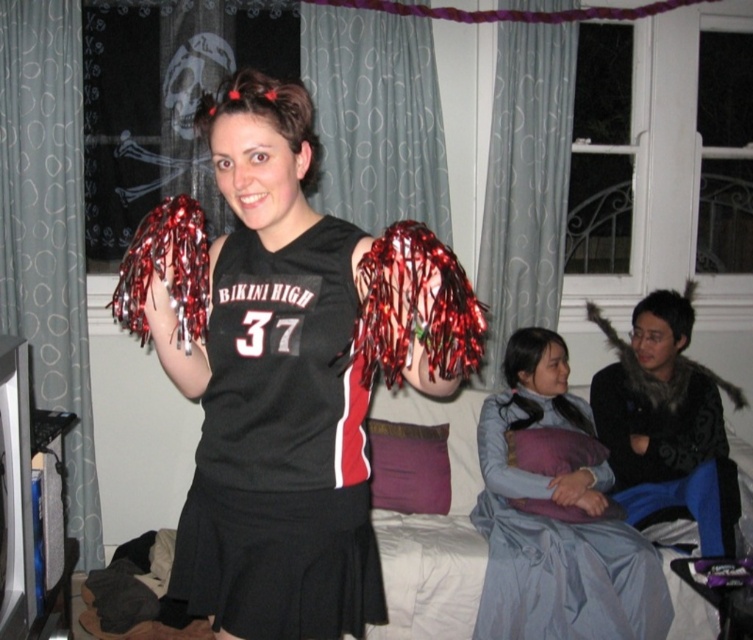
Question: Based on their relative distances, which object is nearer to the matte black cheerleader outfit at center?

Choices:
 (A) light blue satin dress at lower right
 (B) black jersey at center

Answer: (B)

Question: Which point appears farthest from the camera in this image?

Choices:
 (A) (604, 637)
 (B) (354, 236)

Answer: (A)

Question: Is black jersey at center positioned at the back of light blue satin dress at lower right?

Choices:
 (A) no
 (B) yes

Answer: (A)

Question: Which of the following is the farthest from the observer?

Choices:
 (A) matte black cheerleader outfit at center
 (B) black jersey at center

Answer: (B)

Question: Is black jersey at center to the right of light blue satin dress at lower right from the viewer's perspective?

Choices:
 (A) no
 (B) yes

Answer: (A)

Question: Can you confirm if matte black cheerleader outfit at center is wider than black jersey at center?

Choices:
 (A) no
 (B) yes

Answer: (B)